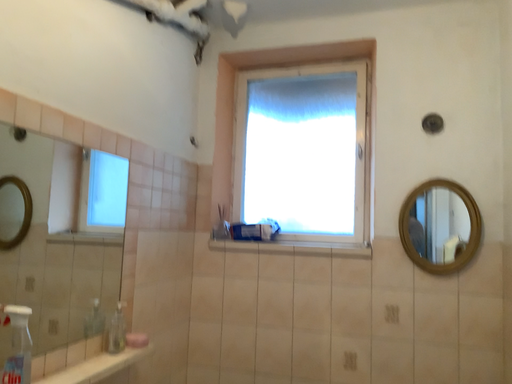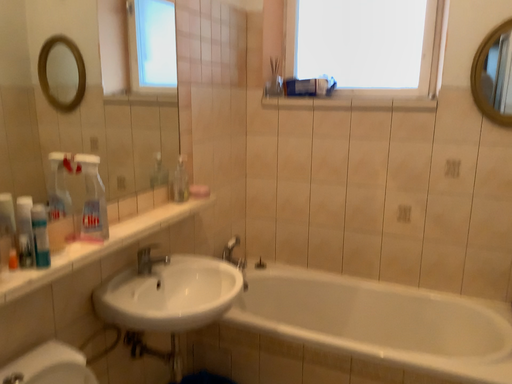
Question: Which way did the camera rotate in the video?

Choices:
 (A) rotated left
 (B) rotated right

Answer: (A)